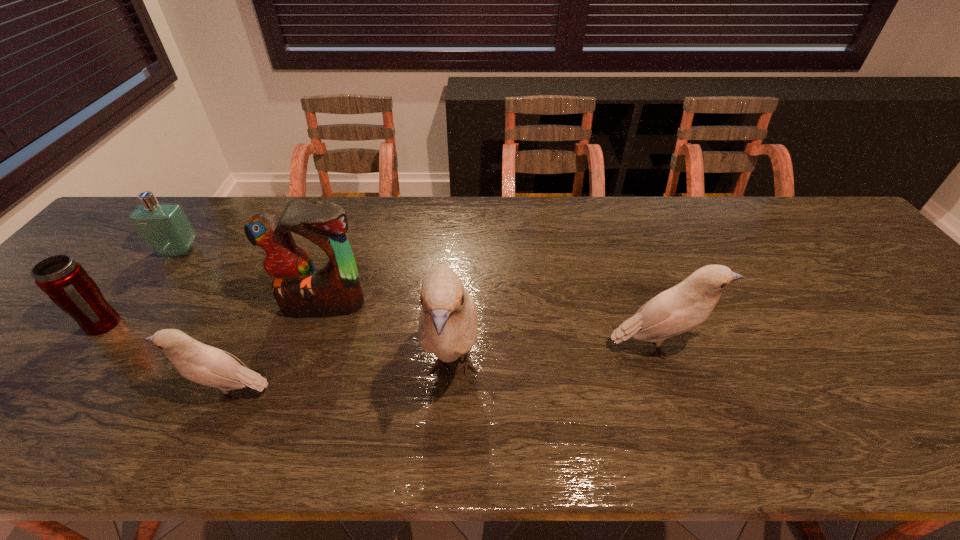
At what (x,y) coordinates should I click in order to perform the action: click on free space located 0.330m at the beak of the shortest bird. Please return your answer as a coordinate pair (x, y). The image size is (960, 540). Looking at the image, I should click on (31, 393).

This screenshot has height=540, width=960. What are the coordinates of `free point located 0.190m at the beak of the fourth shortest object` in the screenshot? It's located at (788, 347).

Where is `free space located on the front label of the farthest object`? Image resolution: width=960 pixels, height=540 pixels. free space located on the front label of the farthest object is located at coordinates click(x=88, y=372).

Identify the location of vacant space positioned on the side with the handle of the thermos bottle. Image resolution: width=960 pixels, height=540 pixels. (252, 325).

In order to click on vacant area situated 0.230m at the face of the parrot in this screenshot , I will do `click(289, 405)`.

Where is `object present at the left edge`? This screenshot has height=540, width=960. object present at the left edge is located at coordinates (64, 280).

In the image, there is a desktop. In order to click on free space at the far edge in this screenshot , I will do `click(653, 239)`.

Find the location of a particular element. This screenshot has width=960, height=540. vacant region at the near edge of the desktop is located at coordinates (184, 401).

Locate an element on the screen. free region at the left edge of the desktop is located at coordinates (110, 276).

At what (x,y) coordinates should I click in order to perform the action: click on vacant space at the right edge. Please return your answer as a coordinate pair (x, y). Image resolution: width=960 pixels, height=540 pixels. Looking at the image, I should click on (863, 256).